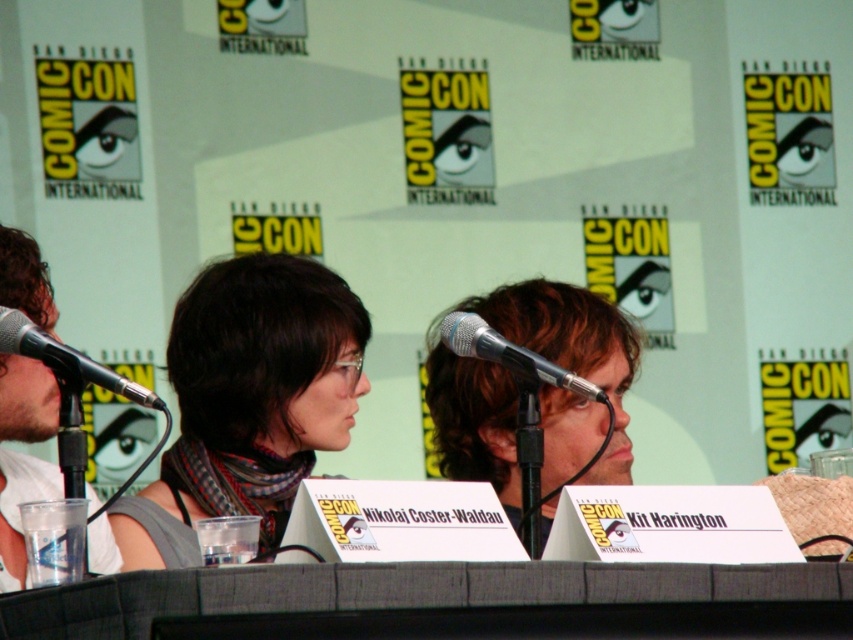
Question: Observing the image, what is the correct spatial positioning of silver metallic microphone at center in reference to black metallic microphone at left?

Choices:
 (A) above
 (B) below

Answer: (A)

Question: Which object appears closest to the camera in this image?

Choices:
 (A) black metallic microphone at left
 (B) light brown hair at center
 (C) white matte shirt at left
 (D) silver metallic microphone at center

Answer: (A)

Question: Can you confirm if gray fabric table at center is bigger than matte black scarf at center?

Choices:
 (A) yes
 (B) no

Answer: (B)

Question: Which of these objects is positioned farthest from the black metallic microphone at left?

Choices:
 (A) light brown hair at center
 (B) white matte shirt at left
 (C) gray fabric table at center

Answer: (A)

Question: Is gray fabric table at center closer to camera compared to light brown hair at center?

Choices:
 (A) no
 (B) yes

Answer: (B)

Question: Which is nearer to the white matte shirt at left?

Choices:
 (A) matte black scarf at center
 (B) black metallic microphone at left
 (C) silver metallic microphone at center
 (D) gray fabric table at center

Answer: (A)